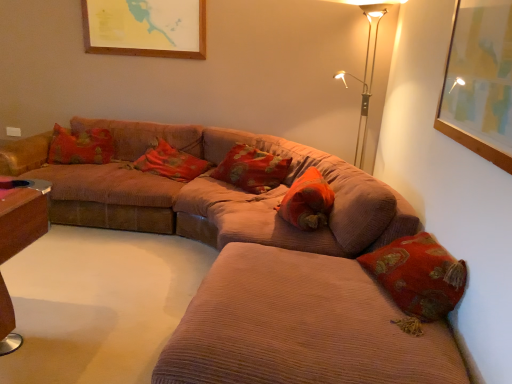
Question: Which direction should I rotate to face red velvet cushion at center, which is the third pillow from left to right, — up or down?

Choices:
 (A) up
 (B) down

Answer: (B)

Question: From a real-world perspective, is corduroy couch at lower right physically below corduroy pillow at center, arranged as the first pillow when viewed from the left?

Choices:
 (A) no
 (B) yes

Answer: (B)

Question: Is corduroy couch at lower right looking in the opposite direction of corduroy pillow at center, arranged as the first pillow when viewed from the left?

Choices:
 (A) yes
 (B) no

Answer: (B)

Question: Does corduroy couch at lower right come behind corduroy pillow at center, marked as the third pillow in a right-to-left arrangement?

Choices:
 (A) yes
 (B) no

Answer: (B)

Question: From the image's perspective, is corduroy couch at lower right on corduroy pillow at center, marked as the third pillow in a right-to-left arrangement?

Choices:
 (A) no
 (B) yes

Answer: (A)

Question: Can you confirm if corduroy couch at lower right is shorter than corduroy pillow at center, arranged as the first pillow when viewed from the left?

Choices:
 (A) no
 (B) yes

Answer: (A)

Question: Can you confirm if corduroy couch at lower right is positioned to the right of corduroy pillow at center, arranged as the first pillow when viewed from the left?

Choices:
 (A) yes
 (B) no

Answer: (A)

Question: Is matte red pillow at center, the 2th pillow in the right-to-left sequence, at the back of corduroy pillow at center, arranged as the first pillow when viewed from the left?

Choices:
 (A) no
 (B) yes

Answer: (A)

Question: Is corduroy pillow at center, marked as the third pillow in a right-to-left arrangement, at the right side of matte red pillow at center, the 2th pillow in the right-to-left sequence?

Choices:
 (A) no
 (B) yes

Answer: (A)

Question: Is corduroy pillow at center, arranged as the first pillow when viewed from the left, aimed at matte red pillow at center, the second pillow positioned from the left?

Choices:
 (A) no
 (B) yes

Answer: (A)

Question: Can you confirm if corduroy pillow at center, marked as the third pillow in a right-to-left arrangement, is shorter than matte red pillow at center, the second pillow positioned from the left?

Choices:
 (A) no
 (B) yes

Answer: (B)

Question: Is corduroy pillow at center, marked as the third pillow in a right-to-left arrangement, positioned behind matte red pillow at center, the second pillow positioned from the left?

Choices:
 (A) yes
 (B) no

Answer: (A)

Question: Is corduroy pillow at center, marked as the third pillow in a right-to-left arrangement, at the left side of matte red pillow at center, the 2th pillow in the right-to-left sequence?

Choices:
 (A) no
 (B) yes

Answer: (B)

Question: Can metallic gold floor lamp at upper right be found inside red velvet cushion at center, which is the third pillow from left to right?

Choices:
 (A) yes
 (B) no

Answer: (B)